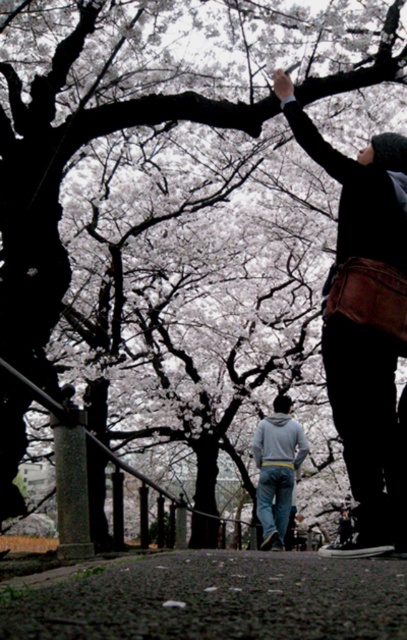
Question: Is dark asphalt path at lower center thinner than denim jeans at center?

Choices:
 (A) no
 (B) yes

Answer: (A)

Question: Which object is positioned farthest from the dark asphalt path at lower center?

Choices:
 (A) dark brown leather bag at upper right
 (B) denim jeans at center

Answer: (B)

Question: Observing the image, what is the correct spatial positioning of dark asphalt path at lower center in reference to denim jeans at center?

Choices:
 (A) below
 (B) above

Answer: (B)

Question: Is the position of dark asphalt path at lower center less distant than that of dark brown leather bag at upper right?

Choices:
 (A) yes
 (B) no

Answer: (A)

Question: Among these objects, which one is nearest to the camera?

Choices:
 (A) dark asphalt path at lower center
 (B) dark brown leather bag at upper right
 (C) denim jeans at center

Answer: (A)

Question: Which object appears farthest from the camera in this image?

Choices:
 (A) dark asphalt path at lower center
 (B) dark brown leather bag at upper right
 (C) denim jeans at center

Answer: (C)